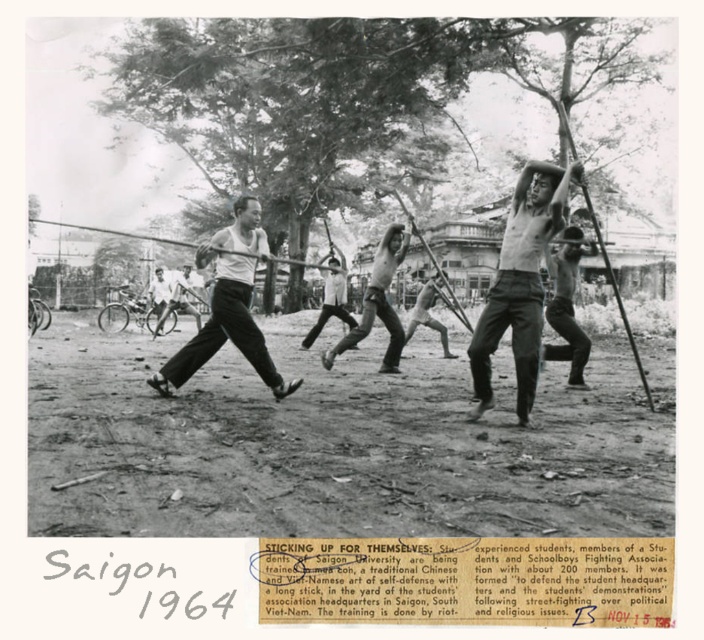
You are a photographer in 1964 taking a picture of a martial arts group in Saigon. You notice the shiny black pants at center and the white cotton tank top at center. Which clothing item appears shorter in the photo?

The shiny black pants at center appears shorter than the white cotton tank top at center in the photo.

In the 1964 black and white photo of martial artists in Saigon practicing m?o con with long sticks, there is a point labeled at coordinates (x=520, y=284). What object is located at that point?

The point at coordinates (x=520, y=284) indicates shiny black pants at center.

You are a photographer in 1964 observing this martial arts training session. You notice two items at the center of the image. Which item is closer to you, the shiny black pants at center or the white cotton tank top at center?

The shiny black pants at center is in front of the white cotton tank top at center, so the shiny black pants at center is closer to you.